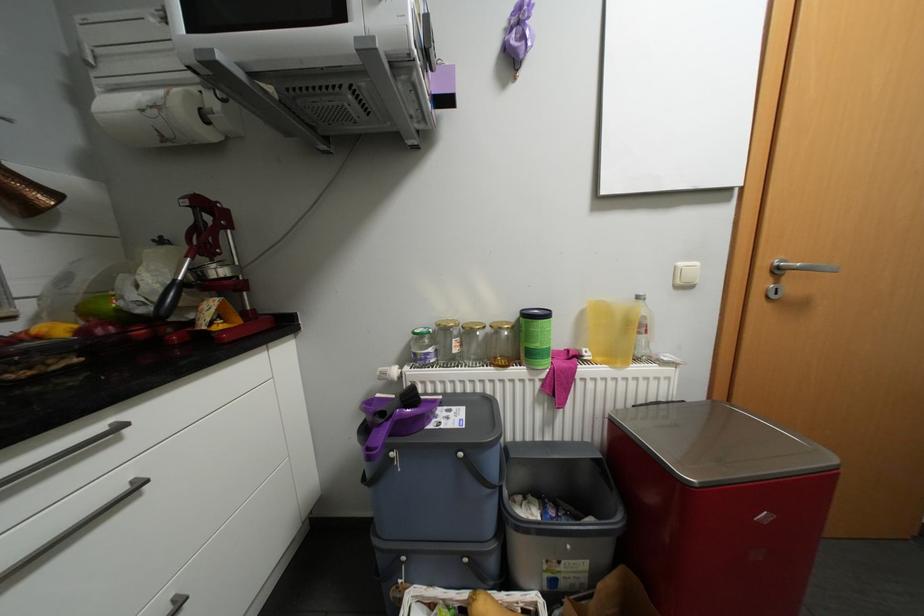
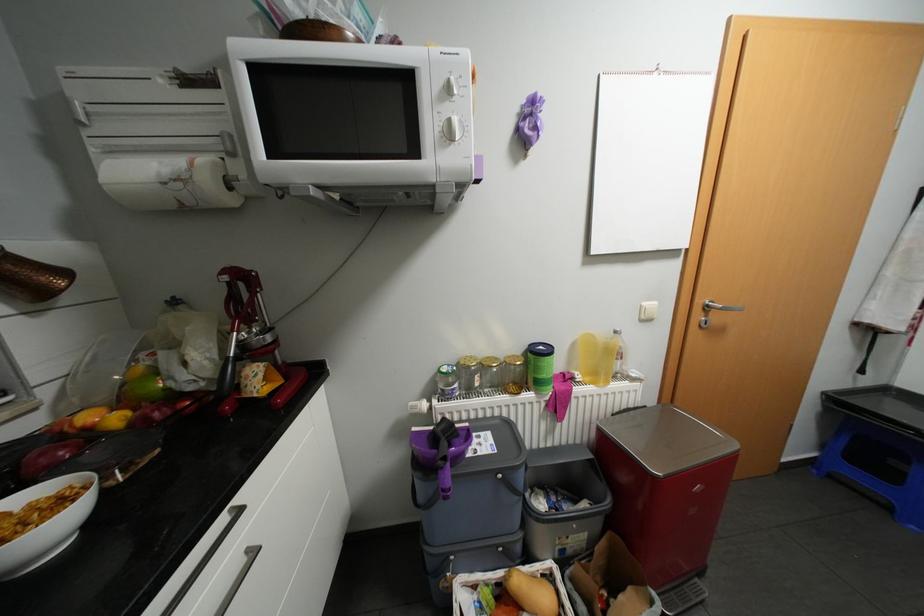
The point at (784, 265) is marked in the first image. Where is the corresponding point in the second image?

(715, 305)